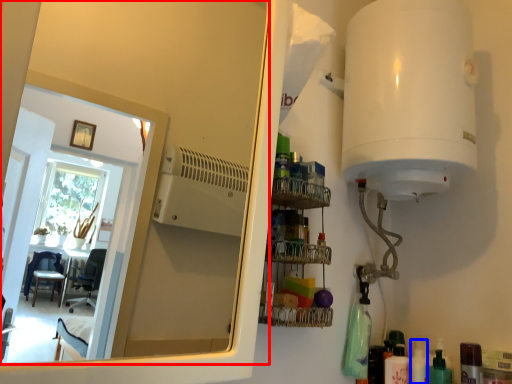
Question: Among these objects, which one is nearest to the camera, mirror (highlighted by a red box) or toiletry (highlighted by a blue box)?

Choices:
 (A) mirror
 (B) toiletry

Answer: (A)